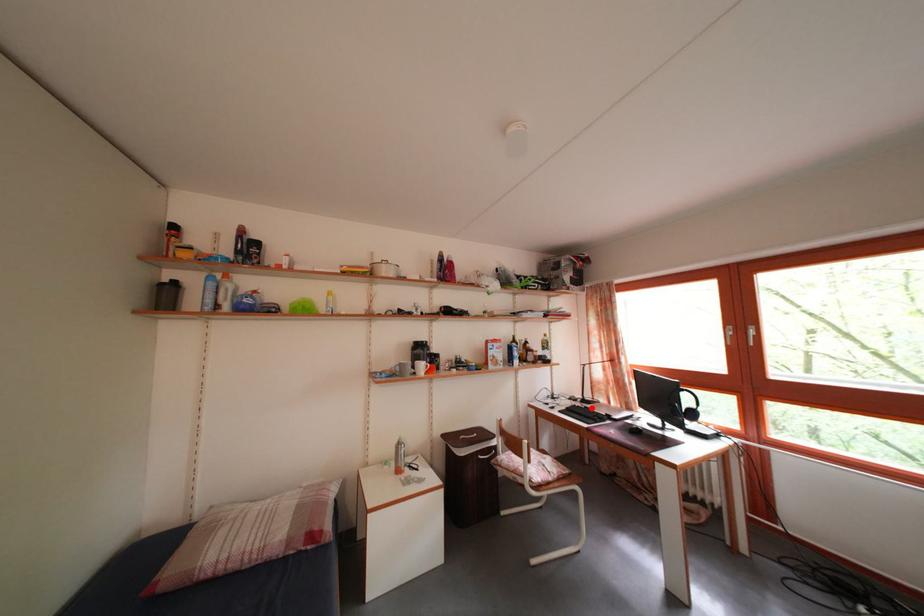
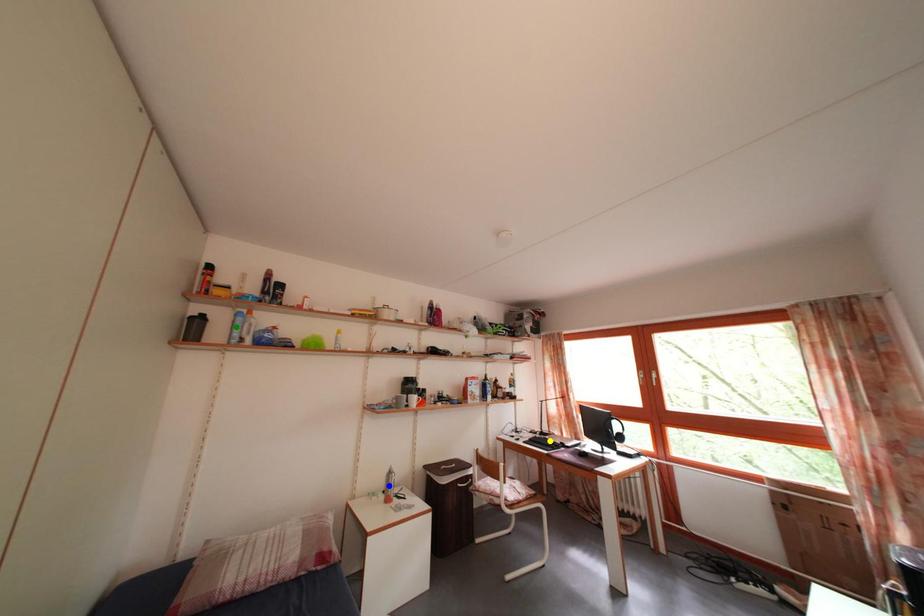
Question: I am providing you with two images of the same scene from different viewpoints. A red point is marked on the first image. You are given multiple points on the second image. Can you choose the point in image 2 that corresponds to the point in image 1?

Choices:
 (A) green point
 (B) blue point
 (C) yellow point

Answer: (C)